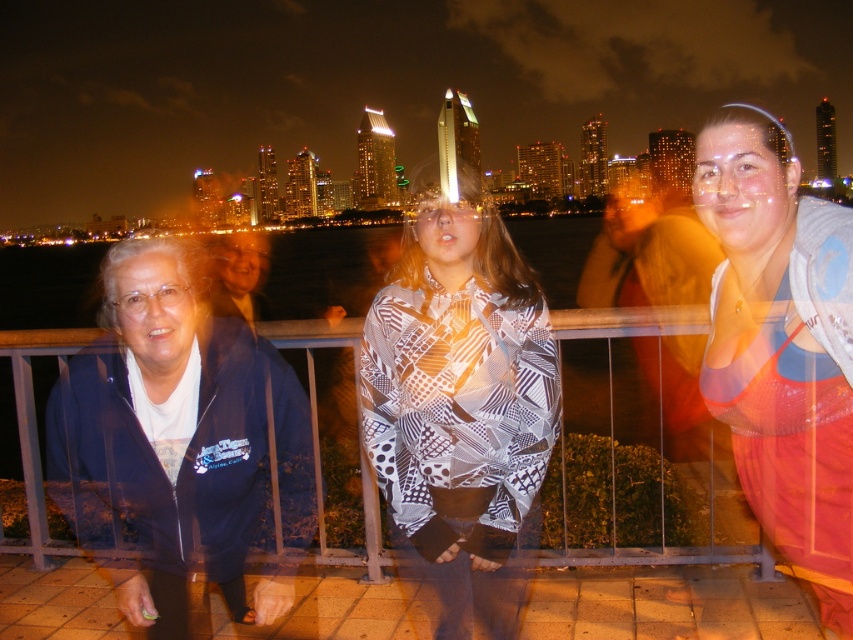
You are standing at the waterfront promenade and want to take a photo of the city skyline. You notice two people wearing different tops in the foreground. The printed fabric blouse at center and the matte gray tank top at right. Since you want the city skyline to be the main focus, which top should you avoid blurring in the foreground to ensure it stays in focus?

To keep both the city skyline and the foreground in focus, you should ensure the printed fabric blouse at center and the matte gray tank top at right are within the depth of field. However, since the distance between them is 204.05 feet, it might be challenging to keep both in focus simultaneously. You may need to adjust your camera settings or choose a focal point that prioritizes either the skyline or the foreground.

You are a photographer trying to capture a clear shot of the city skyline through the window. There are two objects in your way, the printed fabric blouse at center and metallic silver fence at center. Which object should you move to get a better view?

You should move the metallic silver fence at center because it is behind the printed fabric blouse at center, so it is closer to the window and blocking the view more directly.